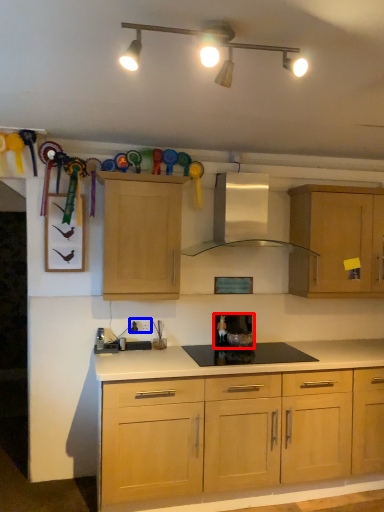
Question: Which of the following is the closest to the observer, appliance (highlighted by a red box) or electric outlet (highlighted by a blue box)?

Choices:
 (A) appliance
 (B) electric outlet

Answer: (B)